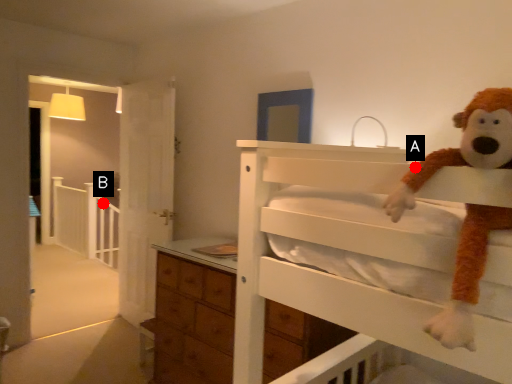
Question: Two points are circled on the image, labeled by A and B beside each circle. Which point appears farthest from the camera in this image?

Choices:
 (A) A is further
 (B) B is further

Answer: (B)